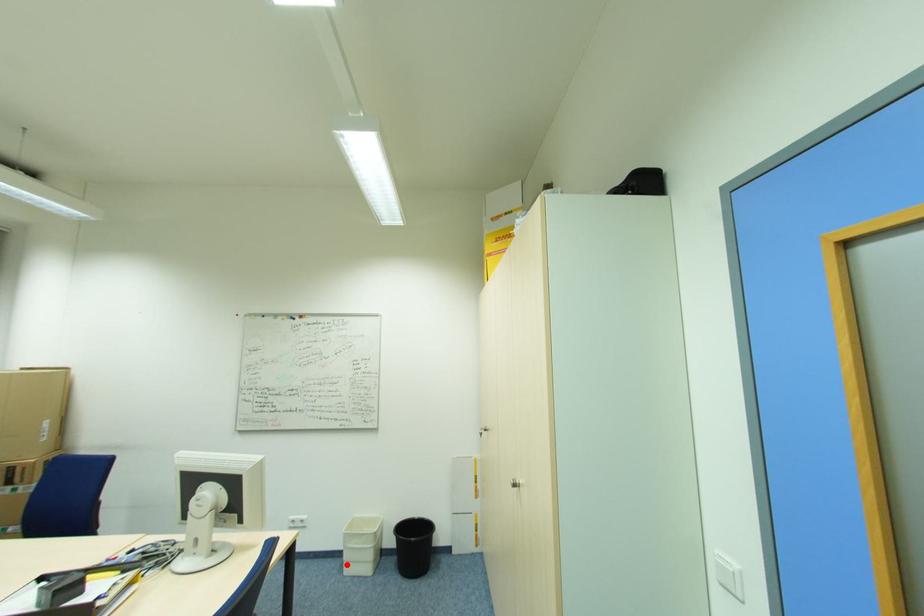
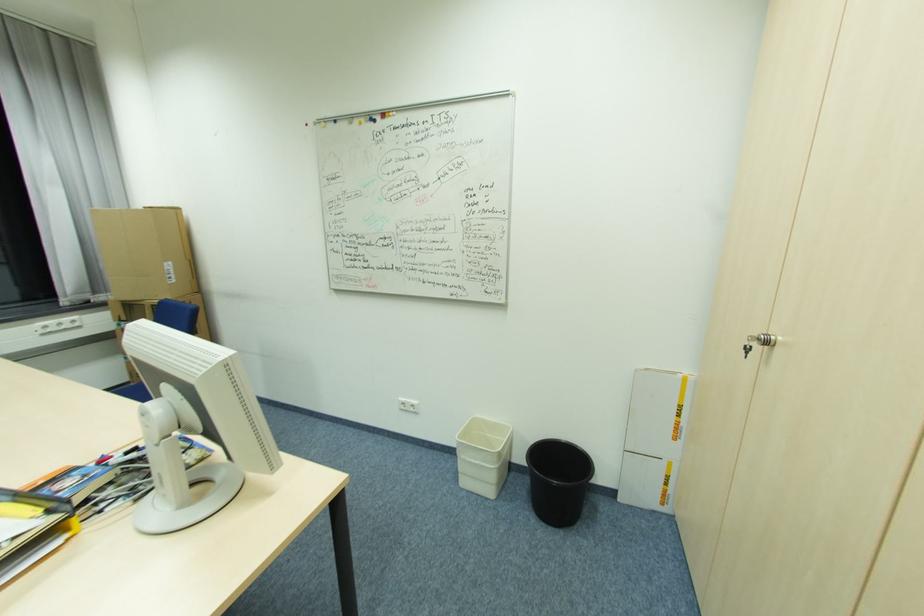
The point at the highlighted location is marked in the first image. Where is the corresponding point in the second image?

(463, 475)